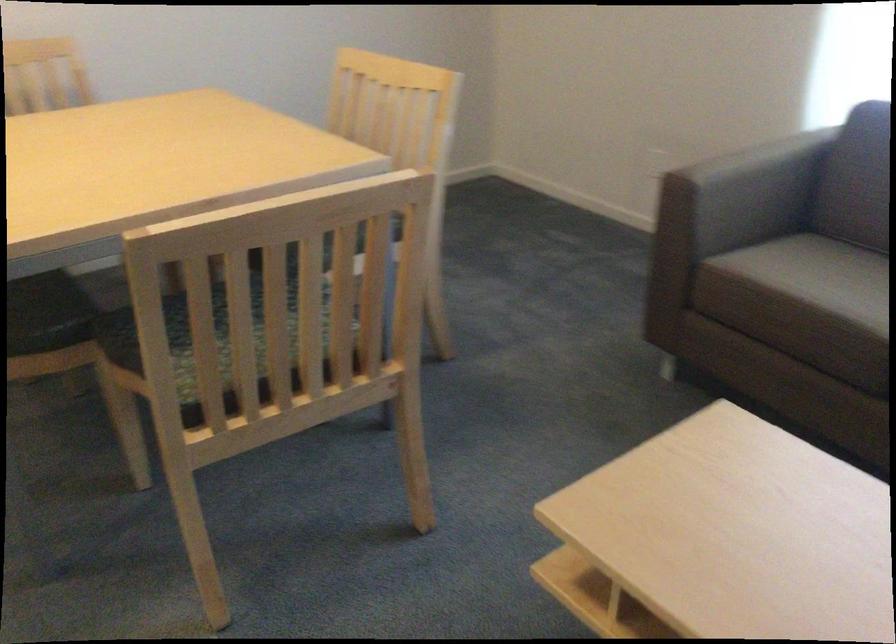
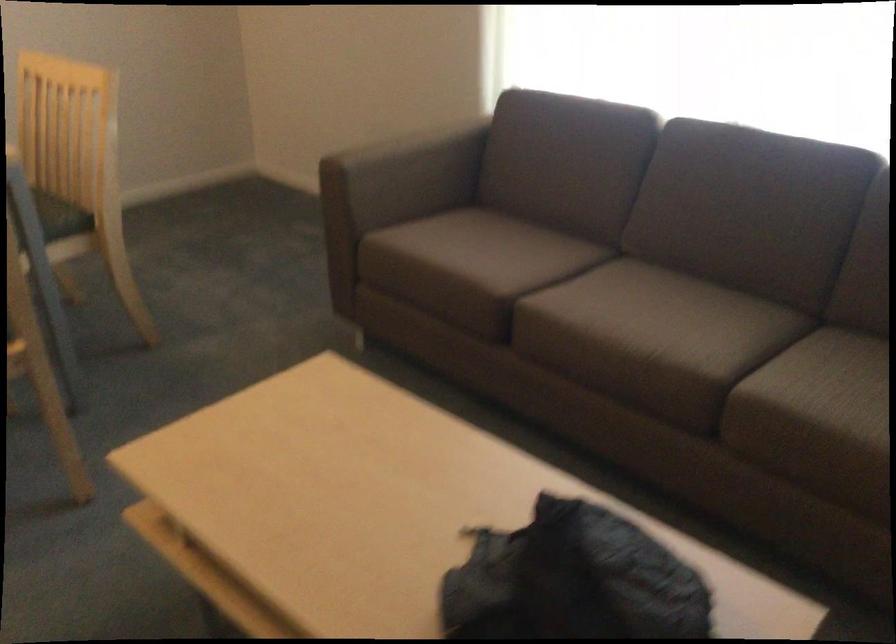
Where in the second image is the point corresponding to (x=743, y=198) from the first image?

(403, 176)